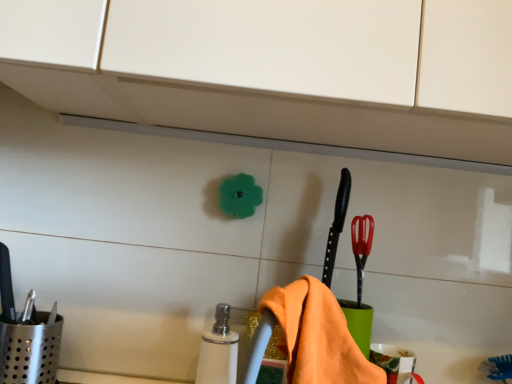
The image size is (512, 384). What do you see at coordinates (317, 336) in the screenshot?
I see `orange cotton towel at lower center` at bounding box center [317, 336].

Measure the distance between point (361, 266) and camera.

The depth of point (361, 266) is 35.55 inches.

Where is `white glossy soap dispenser at center`? white glossy soap dispenser at center is located at coordinates (218, 350).

You are a GUI agent. You are given a task and a screenshot of the screen. Output one action in this format:
    pyautogui.click(x=<x>, y=<y>)
    Task: Click on the orange cotton towel at lower center
    The image size is (512, 384).
    Given the screenshot: What is the action you would take?
    pyautogui.click(x=317, y=336)

Could you tell me if red plastic brush at right is facing orange cotton towel at lower center?

No, red plastic brush at right is not oriented towards orange cotton towel at lower center.

Is red plastic brush at right taller or shorter than orange cotton towel at lower center?

In the image, red plastic brush at right appears to be shorter than orange cotton towel at lower center.

Which object is closer to the camera, red plastic brush at right or orange cotton towel at lower center?

orange cotton towel at lower center.

How many degrees apart are the facing directions of orange cotton towel at lower center and red plastic brush at right?

The angle between the facing direction of orange cotton towel at lower center and the facing direction of red plastic brush at right is 41.5 degrees.

Considering the relative sizes of orange cotton towel at lower center and red plastic brush at right in the image provided, is orange cotton towel at lower center bigger than red plastic brush at right?

Yes, orange cotton towel at lower center is bigger than red plastic brush at right.

Is orange cotton towel at lower center turned away from red plastic brush at right?

Yes, orange cotton towel at lower center's orientation is away from red plastic brush at right.

Is red plastic brush at right completely or partially inside orange cotton towel at lower center?

No, red plastic brush at right is not a part of orange cotton towel at lower center.

Would you consider white glossy soap dispenser at center to be distant from red plastic brush at right?

They are positioned close to each other.

Is point (227, 378) closer or farther from the camera than point (358, 283)?

Clearly, point (227, 378) is closer to the camera than point (358, 283).

Which object is thinner, white glossy soap dispenser at center or red plastic brush at right?

red plastic brush at right is thinner.

Can you confirm if white glossy soap dispenser at center is positioned to the right of red plastic brush at right?

In fact, white glossy soap dispenser at center is to the left of red plastic brush at right.

Does orange cotton towel at lower center have a larger size compared to white glossy soap dispenser at center?

Indeed, orange cotton towel at lower center has a larger size compared to white glossy soap dispenser at center.

In the scene shown: From the image's perspective, between orange cotton towel at lower center and white glossy soap dispenser at center, who is located below?

From the image's view, white glossy soap dispenser at center is below.

Is white glossy soap dispenser at center completely or partially inside orange cotton towel at lower center?

No, white glossy soap dispenser at center is not surrounded by orange cotton towel at lower center.

Is orange cotton towel at lower center aimed at white glossy soap dispenser at center?

No, orange cotton towel at lower center is not facing towards white glossy soap dispenser at center.

Is white glossy soap dispenser at center looking in the opposite direction of orange cotton towel at lower center?

white glossy soap dispenser at center is not turned away from orange cotton towel at lower center.

Measure the distance from white glossy soap dispenser at center to orange cotton towel at lower center.

white glossy soap dispenser at center is 9.72 inches away from orange cotton towel at lower center.

Is white glossy soap dispenser at center positioned behind orange cotton towel at lower center?

Yes, white glossy soap dispenser at center is behind orange cotton towel at lower center.

From the picture: Can you confirm if white glossy soap dispenser at center is taller than orange cotton towel at lower center?

Yes, white glossy soap dispenser at center is taller than orange cotton towel at lower center.

Is point (357, 286) positioned behind point (222, 364)?

Yes, point (357, 286) is behind point (222, 364).

Is red plastic brush at right aimed at white glossy soap dispenser at center?

No, red plastic brush at right is not facing towards white glossy soap dispenser at center.

Who is shorter, red plastic brush at right or white glossy soap dispenser at center?

With less height is red plastic brush at right.

From the image's perspective, would you say red plastic brush at right is shown under white glossy soap dispenser at center?

No, from the image's perspective, red plastic brush at right is not below white glossy soap dispenser at center.

At what (x,y) coordinates should I click in order to perform the action: click on bath towel to the left of red plastic brush at right. Please return your answer as a coordinate pair (x, y). Looking at the image, I should click on (317, 336).

What are the coordinates of `bath towel in front of the red plastic brush at right` in the screenshot? It's located at (317, 336).

Based on their spatial positions, is white glossy soap dispenser at center or orange cotton towel at lower center further from red plastic brush at right?

The object further to red plastic brush at right is white glossy soap dispenser at center.

Based on the photo, looking at the image, which one is located closer to red plastic brush at right, orange cotton towel at lower center or white glossy soap dispenser at center?

The object closer to red plastic brush at right is orange cotton towel at lower center.

From the image, which object appears to be nearer to orange cotton towel at lower center, red plastic brush at right or white glossy soap dispenser at center?

red plastic brush at right lies closer to orange cotton towel at lower center than the other object.

Which object lies nearer to the anchor point white glossy soap dispenser at center, red plastic brush at right or orange cotton towel at lower center?

orange cotton towel at lower center is closer to white glossy soap dispenser at center.

When comparing their distances from orange cotton towel at lower center, does white glossy soap dispenser at center or red plastic brush at right seem closer?

The object closer to orange cotton towel at lower center is red plastic brush at right.

When comparing their distances from white glossy soap dispenser at center, does orange cotton towel at lower center or red plastic brush at right seem further?

red plastic brush at right lies further to white glossy soap dispenser at center than the other object.

Image resolution: width=512 pixels, height=384 pixels. Find the location of `toiletry between orange cotton towel at lower center and red plastic brush at right along the z-axis`. toiletry between orange cotton towel at lower center and red plastic brush at right along the z-axis is located at coordinates (218, 350).